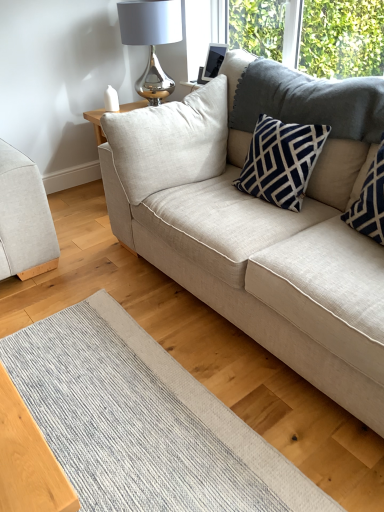
Question: Is the surface of navy blue textured pillow at upper right, placed as the 1th pillow when sorted from right to left, in direct contact with navy blue textured pillow at upper right, the first pillow when ordered from left to right?

Choices:
 (A) yes
 (B) no

Answer: (B)

Question: Does navy blue textured pillow at upper right, placed as the 1th pillow when sorted from right to left, have a lesser height compared to navy blue textured pillow at upper right, marked as the second pillow in a right-to-left arrangement?

Choices:
 (A) no
 (B) yes

Answer: (A)

Question: From the image's perspective, does navy blue textured pillow at upper right, positioned as the second pillow in left-to-right order, appear lower than navy blue textured pillow at upper right, the first pillow when ordered from left to right?

Choices:
 (A) yes
 (B) no

Answer: (A)

Question: Does navy blue textured pillow at upper right, placed as the 1th pillow when sorted from right to left, have a greater width compared to navy blue textured pillow at upper right, marked as the second pillow in a right-to-left arrangement?

Choices:
 (A) no
 (B) yes

Answer: (A)

Question: Does navy blue textured pillow at upper right, positioned as the second pillow in left-to-right order, appear on the right side of navy blue textured pillow at upper right, the first pillow when ordered from left to right?

Choices:
 (A) yes
 (B) no

Answer: (A)

Question: Looking at their shapes, would you say beige fabric couch at center, acting as the 2th studio couch starting from the left, is wider or thinner than navy blue textured pillow at upper right, the first pillow when ordered from left to right?

Choices:
 (A) wide
 (B) thin

Answer: (A)

Question: In the image, is beige fabric couch at center, acting as the 2th studio couch starting from the left, positioned in front of or behind navy blue textured pillow at upper right, the first pillow when ordered from left to right?

Choices:
 (A) behind
 (B) front

Answer: (B)

Question: Does point (251, 315) appear closer or farther from the camera than point (284, 135)?

Choices:
 (A) closer
 (B) farther

Answer: (A)

Question: From their relative heights in the image, would you say beige fabric couch at center, which is the 1th studio couch from right to left, is taller or shorter than navy blue textured pillow at upper right, marked as the second pillow in a right-to-left arrangement?

Choices:
 (A) short
 (B) tall

Answer: (B)

Question: Is textured gray mat at lower center wider or thinner than beige fabric couch at center, which is the 1th studio couch from right to left?

Choices:
 (A) wide
 (B) thin

Answer: (A)

Question: From the image's perspective, is textured gray mat at lower center located above or below beige fabric couch at center, which is the 1th studio couch from right to left?

Choices:
 (A) above
 (B) below

Answer: (B)

Question: Considering the positions of textured gray mat at lower center and beige fabric couch at center, which is the 1th studio couch from right to left, in the image, is textured gray mat at lower center bigger or smaller than beige fabric couch at center, which is the 1th studio couch from right to left,?

Choices:
 (A) big
 (B) small

Answer: (B)

Question: From a real-world perspective, relative to beige fabric couch at center, acting as the 2th studio couch starting from the left, is textured gray mat at lower center vertically above or below?

Choices:
 (A) above
 (B) below

Answer: (B)

Question: From a real-world perspective, is beige fabric couch at center, acting as the 2th studio couch starting from the left, positioned above or below navy blue textured pillow at upper right, positioned as the second pillow in left-to-right order?

Choices:
 (A) below
 (B) above

Answer: (A)

Question: Considering their positions, is beige fabric couch at center, which is the 1th studio couch from right to left, located in front of or behind navy blue textured pillow at upper right, positioned as the second pillow in left-to-right order?

Choices:
 (A) front
 (B) behind

Answer: (A)